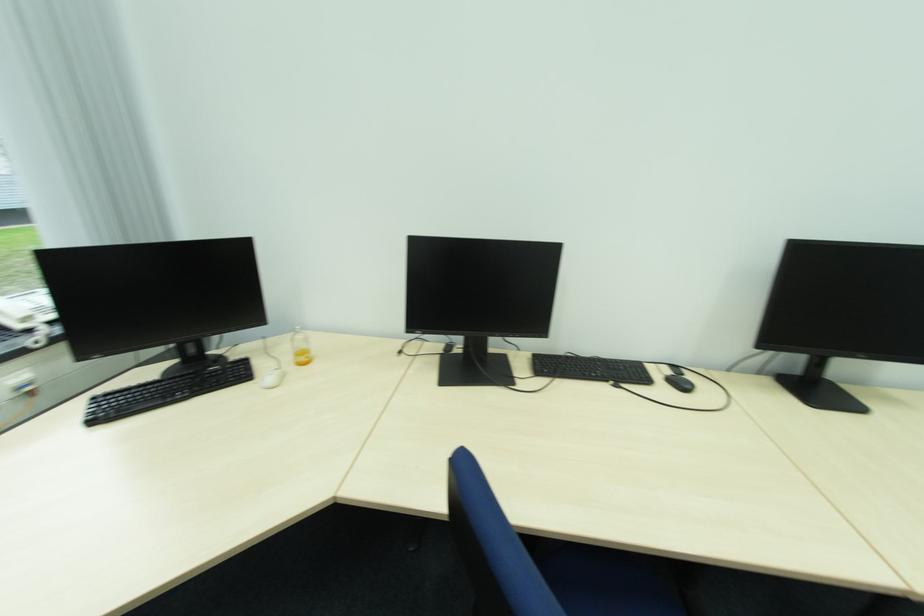
Find where to press the telephone buttons. Please return your answer as a coordinate pair (x, y).

(164, 391)